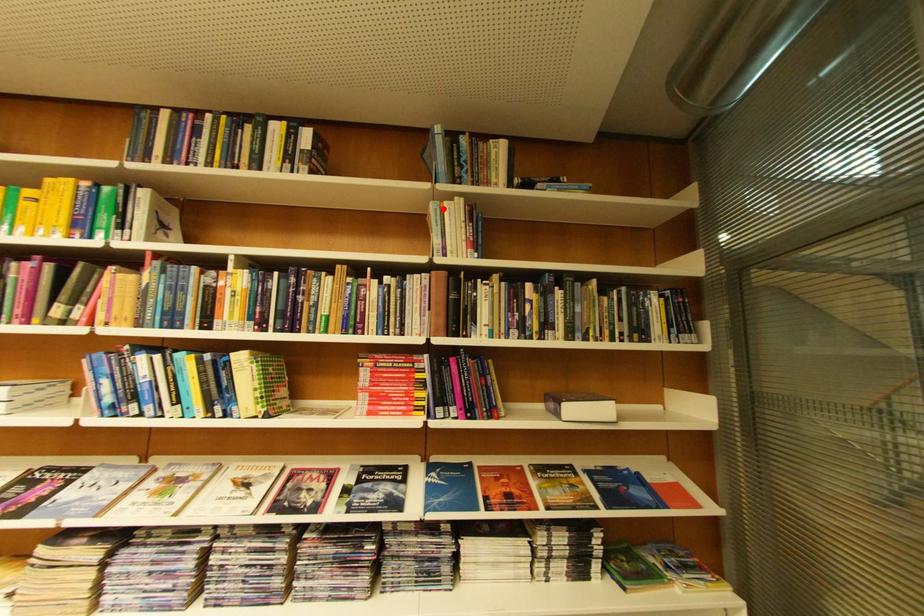
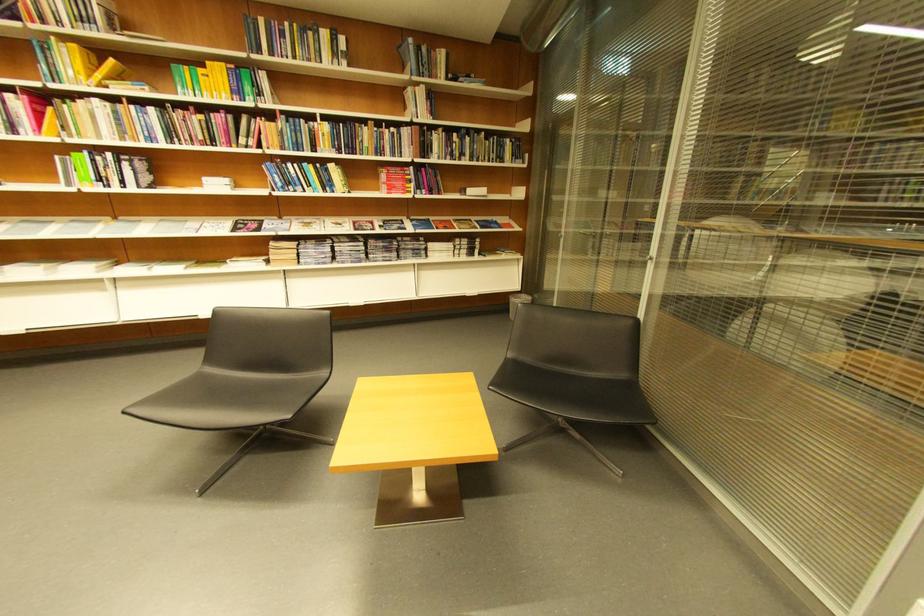
Where in the second image is the point corresponding to the highlighted location from the first image?

(419, 91)